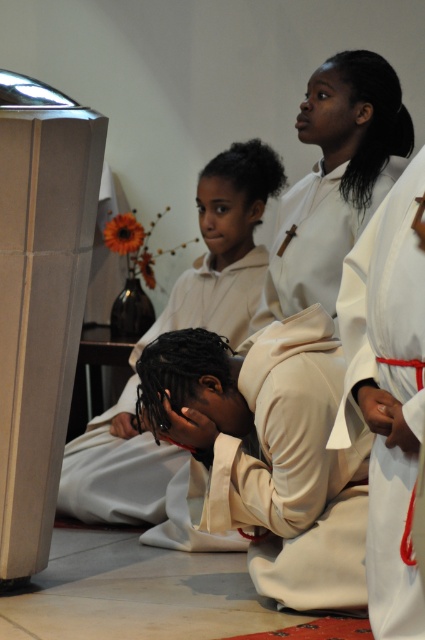
You are standing in the church and need to determine which of the two points, point (189, 276) or point (388, 76), is closer to you. Which one is nearer?

Point (189, 276) is closer to you because it is further to the viewer than point (388, 76).

You are a photographer trying to capture the scene from the back of the church. You notice the white matte robe at lower center and the white matte hair at upper center. Which object would appear bigger in your photo?

The white matte robe at lower center would appear bigger in the photo because it has a larger size compared to the white matte hair at upper center according to the description.